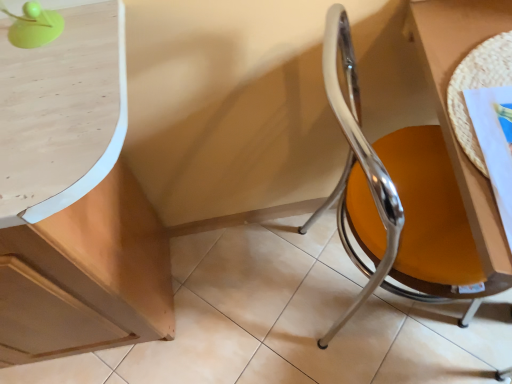
Question: Considering the relative sizes of green plastic ball at upper left and woven mat at right in the image provided, is green plastic ball at upper left smaller than woven mat at right?

Choices:
 (A) yes
 (B) no

Answer: (B)

Question: From the image's perspective, is green plastic ball at upper left beneath woven mat at right?

Choices:
 (A) no
 (B) yes

Answer: (A)

Question: From the image's perspective, is green plastic ball at upper left over woven mat at right?

Choices:
 (A) yes
 (B) no

Answer: (A)

Question: Is the position of green plastic ball at upper left more distant than that of woven mat at right?

Choices:
 (A) yes
 (B) no

Answer: (B)

Question: Is green plastic ball at upper left bigger than woven mat at right?

Choices:
 (A) yes
 (B) no

Answer: (A)

Question: From a real-world perspective, is green plastic ball at upper left physically above woven mat at right?

Choices:
 (A) yes
 (B) no

Answer: (A)

Question: Is green plastic ball at upper left looking in the opposite direction of chrome/yellow seat at right?

Choices:
 (A) no
 (B) yes

Answer: (A)

Question: From the image's perspective, does green plastic ball at upper left appear lower than chrome/yellow seat at right?

Choices:
 (A) yes
 (B) no

Answer: (B)

Question: Is green plastic ball at upper left positioned behind chrome/yellow seat at right?

Choices:
 (A) yes
 (B) no

Answer: (B)

Question: Is green plastic ball at upper left aimed at chrome/yellow seat at right?

Choices:
 (A) yes
 (B) no

Answer: (B)

Question: Does green plastic ball at upper left have a smaller size compared to chrome/yellow seat at right?

Choices:
 (A) yes
 (B) no

Answer: (A)

Question: Can you confirm if green plastic ball at upper left is thinner than chrome/yellow seat at right?

Choices:
 (A) yes
 (B) no

Answer: (A)

Question: Is chrome/yellow seat at right not within green plastic ball at upper left?

Choices:
 (A) no
 (B) yes

Answer: (B)